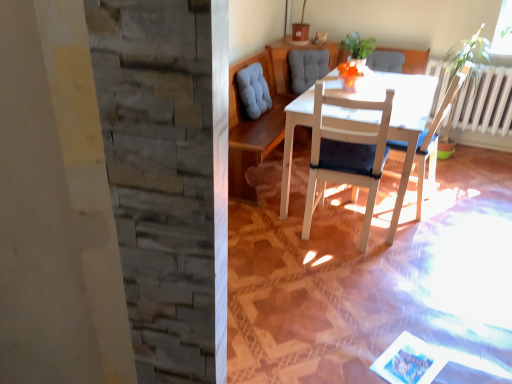
Question: Is white wood chair at center, which appears as the 1th chair when viewed from the right, closer to the viewer compared to white wood table at center?

Choices:
 (A) no
 (B) yes

Answer: (A)

Question: Can you confirm if white wood chair at center, acting as the second chair starting from the left, is taller than white wood table at center?

Choices:
 (A) no
 (B) yes

Answer: (B)

Question: Does white wood chair at center, which appears as the 1th chair when viewed from the right, have a lesser height compared to white wood table at center?

Choices:
 (A) no
 (B) yes

Answer: (A)

Question: Can you confirm if white wood chair at center, acting as the second chair starting from the left, is wider than white wood table at center?

Choices:
 (A) yes
 (B) no

Answer: (B)

Question: Is white wood chair at center, acting as the second chair starting from the left, at the right side of white wood table at center?

Choices:
 (A) no
 (B) yes

Answer: (B)

Question: From the image's perspective, relative to white wood chair at center, which is counted as the first chair, starting from the left, is green leafy plant at upper center above or below?

Choices:
 (A) above
 (B) below

Answer: (A)

Question: Is point (371, 48) positioned closer to the camera than point (365, 132)?

Choices:
 (A) farther
 (B) closer

Answer: (A)

Question: In terms of width, does green leafy plant at upper center look wider or thinner when compared to white wood chair at center, placed as the second chair when sorted from right to left?

Choices:
 (A) wide
 (B) thin

Answer: (B)

Question: Is green leafy plant at upper center in front of or behind white wood chair at center, placed as the second chair when sorted from right to left, in the image?

Choices:
 (A) front
 (B) behind

Answer: (B)

Question: Is white wood chair at center, which appears as the 1th chair when viewed from the right, bigger or smaller than white wood chair at center, which is counted as the first chair, starting from the left?

Choices:
 (A) big
 (B) small

Answer: (B)

Question: From a real-world perspective, is white wood chair at center, acting as the second chair starting from the left, physically located above or below white wood chair at center, placed as the second chair when sorted from right to left?

Choices:
 (A) above
 (B) below

Answer: (A)

Question: Is point (391, 145) closer or farther from the camera than point (364, 241)?

Choices:
 (A) farther
 (B) closer

Answer: (A)

Question: In terms of width, does white wood chair at center, acting as the second chair starting from the left, look wider or thinner when compared to white wood chair at center, which is counted as the first chair, starting from the left?

Choices:
 (A) wide
 (B) thin

Answer: (B)

Question: In terms of size, does green leafy plant at upper center appear bigger or smaller than white wood chair at center, which appears as the 1th chair when viewed from the right?

Choices:
 (A) big
 (B) small

Answer: (B)

Question: Would you say green leafy plant at upper center is to the left or to the right of white wood chair at center, which appears as the 1th chair when viewed from the right, in the picture?

Choices:
 (A) right
 (B) left

Answer: (B)